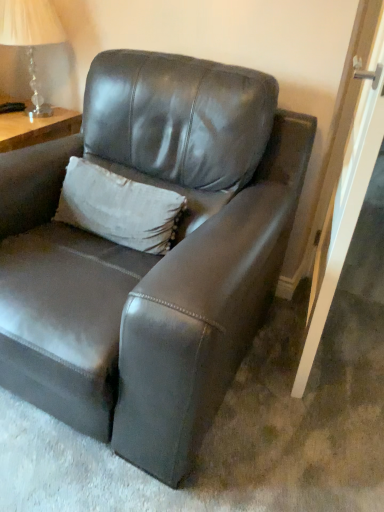
Question: From the image's perspective, is white textured pillow at upper center beneath matte leather couch at center?

Choices:
 (A) no
 (B) yes

Answer: (A)

Question: Does white textured pillow at upper center have a greater height compared to matte leather couch at center?

Choices:
 (A) no
 (B) yes

Answer: (A)

Question: Considering the relative positions of white textured pillow at upper center and matte leather couch at center in the image provided, is white textured pillow at upper center to the left of matte leather couch at center from the viewer's perspective?

Choices:
 (A) yes
 (B) no

Answer: (A)

Question: Can you confirm if white textured pillow at upper center is thinner than matte leather couch at center?

Choices:
 (A) yes
 (B) no

Answer: (A)

Question: Considering the relative sizes of white textured pillow at upper center and matte leather couch at center in the image provided, is white textured pillow at upper center shorter than matte leather couch at center?

Choices:
 (A) no
 (B) yes

Answer: (B)

Question: From a real-world perspective, is white textured pillow at upper center beneath matte leather couch at center?

Choices:
 (A) no
 (B) yes

Answer: (A)

Question: Is clear glass lamp at upper left positioned beyond the bounds of white textured pillow at upper center?

Choices:
 (A) no
 (B) yes

Answer: (B)

Question: Is clear glass lamp at upper left thinner than white textured pillow at upper center?

Choices:
 (A) no
 (B) yes

Answer: (A)

Question: From a real-world perspective, is clear glass lamp at upper left on top of white textured pillow at upper center?

Choices:
 (A) no
 (B) yes

Answer: (B)

Question: Is clear glass lamp at upper left far from white textured pillow at upper center?

Choices:
 (A) no
 (B) yes

Answer: (A)

Question: Considering the relative positions of clear glass lamp at upper left and white textured pillow at upper center in the image provided, is clear glass lamp at upper left behind white textured pillow at upper center?

Choices:
 (A) no
 (B) yes

Answer: (B)

Question: Does clear glass lamp at upper left contain white textured pillow at upper center?

Choices:
 (A) yes
 (B) no

Answer: (B)

Question: From a real-world perspective, is white textured pillow at upper center located higher than clear glass lamp at upper left?

Choices:
 (A) yes
 (B) no

Answer: (B)